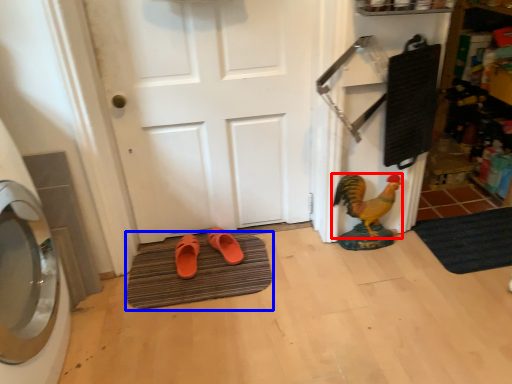
Question: Which object appears closest to the camera in this image, chicken (highlighted by a red box) or bath mat (highlighted by a blue box)?

Choices:
 (A) chicken
 (B) bath mat

Answer: (B)